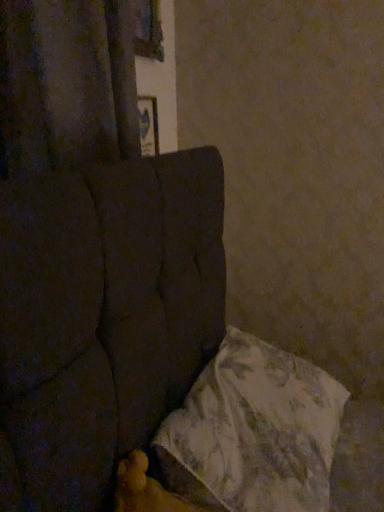
Describe the element at coordinates (254, 431) in the screenshot. I see `fluffy white pillow at lower right` at that location.

What is the approximate width of fluffy white pillow at lower right?

16.88 inches.

Find the location of `fluffy white pillow at lower right`. fluffy white pillow at lower right is located at coordinates (254, 431).

The height and width of the screenshot is (512, 384). What do you see at coordinates (66, 84) in the screenshot?
I see `velvet dark brown curtain at upper left` at bounding box center [66, 84].

Measure the distance between point (89, 92) and camera.

Point (89, 92) and camera are 1.04 meters apart.

At what (x,y) coordinates should I click in order to perform the action: click on velvet dark brown curtain at upper left. Please return your answer as a coordinate pair (x, y). Looking at the image, I should click on (66, 84).

At what (x,y) coordinates should I click in order to perform the action: click on fluffy white pillow at lower right. Please return your answer as a coordinate pair (x, y). This screenshot has height=512, width=384. Looking at the image, I should click on (254, 431).

Would you say fluffy white pillow at lower right is to the left or to the right of velvet dark brown curtain at upper left in the picture?

From the image, it's evident that fluffy white pillow at lower right is to the right of velvet dark brown curtain at upper left.

Is the depth of fluffy white pillow at lower right less than that of velvet dark brown curtain at upper left?

Yes.

Which point is more distant from viewer, (208, 407) or (26, 62)?

Point (26, 62)

From the image's perspective, is fluffy white pillow at lower right located above or below velvet dark brown curtain at upper left?

fluffy white pillow at lower right is below velvet dark brown curtain at upper left.

From a real-world perspective, relative to velvet dark brown curtain at upper left, is fluffy white pillow at lower right vertically above or below?

In terms of real-world spatial position, fluffy white pillow at lower right is below velvet dark brown curtain at upper left.

Is fluffy white pillow at lower right wider than velvet dark brown curtain at upper left?

Indeed, fluffy white pillow at lower right has a greater width compared to velvet dark brown curtain at upper left.

Can you confirm if fluffy white pillow at lower right is shorter than velvet dark brown curtain at upper left?

Correct, fluffy white pillow at lower right is not as tall as velvet dark brown curtain at upper left.

Looking at the image, does fluffy white pillow at lower right seem bigger or smaller compared to velvet dark brown curtain at upper left?

Considering their sizes, fluffy white pillow at lower right takes up more space than velvet dark brown curtain at upper left.

Is velvet dark brown curtain at upper left completely or partially inside fluffy white pillow at lower right?

No, velvet dark brown curtain at upper left is not surrounded by fluffy white pillow at lower right.

Is fluffy white pillow at lower right not close to velvet dark brown curtain at upper left?

Actually, fluffy white pillow at lower right and velvet dark brown curtain at upper left are a little close together.

Is fluffy white pillow at lower right oriented away from velvet dark brown curtain at upper left?

fluffy white pillow at lower right is not turned away from velvet dark brown curtain at upper left.

Measure the distance between fluffy white pillow at lower right and velvet dark brown curtain at upper left.

fluffy white pillow at lower right and velvet dark brown curtain at upper left are 31.12 inches apart from each other.

Identify the location of curtain on the left of fluffy white pillow at lower right. This screenshot has height=512, width=384. (66, 84).

In the scene shown: Visually, is velvet dark brown curtain at upper left positioned to the left or to the right of fluffy white pillow at lower right?

velvet dark brown curtain at upper left is positioned on fluffy white pillow at lower right's left side.

In the image, is velvet dark brown curtain at upper left positioned in front of or behind fluffy white pillow at lower right?

velvet dark brown curtain at upper left is positioned farther from the viewer than fluffy white pillow at lower right.

Is point (107, 108) positioned in front of point (251, 511)?

That is False.

From the image's perspective, which object appears higher, velvet dark brown curtain at upper left or fluffy white pillow at lower right?

velvet dark brown curtain at upper left.

From a real-world perspective, who is located higher, velvet dark brown curtain at upper left or fluffy white pillow at lower right?

From a 3D spatial view, velvet dark brown curtain at upper left is above.

Which of these two, velvet dark brown curtain at upper left or fluffy white pillow at lower right, is wider?

fluffy white pillow at lower right.

From their relative heights in the image, would you say velvet dark brown curtain at upper left is taller or shorter than fluffy white pillow at lower right?

In the image, velvet dark brown curtain at upper left appears to be taller than fluffy white pillow at lower right.

Based on their sizes in the image, would you say velvet dark brown curtain at upper left is bigger or smaller than fluffy white pillow at lower right?

In the image, velvet dark brown curtain at upper left appears to be smaller than fluffy white pillow at lower right.

From the picture: Is velvet dark brown curtain at upper left located outside fluffy white pillow at lower right?

velvet dark brown curtain at upper left lies outside fluffy white pillow at lower right's area.

Is velvet dark brown curtain at upper left far from fluffy white pillow at lower right?

They are positioned close to each other.

Could you tell me if velvet dark brown curtain at upper left is facing fluffy white pillow at lower right?

No, velvet dark brown curtain at upper left is not facing towards fluffy white pillow at lower right.

Consider the image. What's the angular difference between velvet dark brown curtain at upper left and fluffy white pillow at lower right's facing directions?

The angle between the facing direction of velvet dark brown curtain at upper left and the facing direction of fluffy white pillow at lower right is 4.32 degrees.

In order to click on curtain located behind the fluffy white pillow at lower right in this screenshot , I will do tap(66, 84).

Find the location of a particular element. The height and width of the screenshot is (512, 384). curtain above the fluffy white pillow at lower right (from a real-world perspective) is located at coordinates (66, 84).

Where is `curtain behind the fluffy white pillow at lower right`? Image resolution: width=384 pixels, height=512 pixels. curtain behind the fluffy white pillow at lower right is located at coordinates (66, 84).